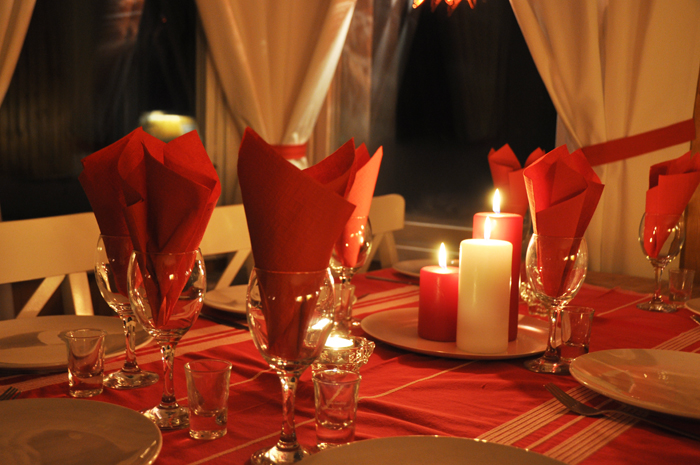
At what (x,y) coordinates should I click in order to perform the action: click on napkins. Please return your answer as a coordinate pair (x, y). The height and width of the screenshot is (465, 700). Looking at the image, I should click on (119, 175), (173, 184), (302, 216), (360, 179), (512, 182), (560, 200), (673, 199).